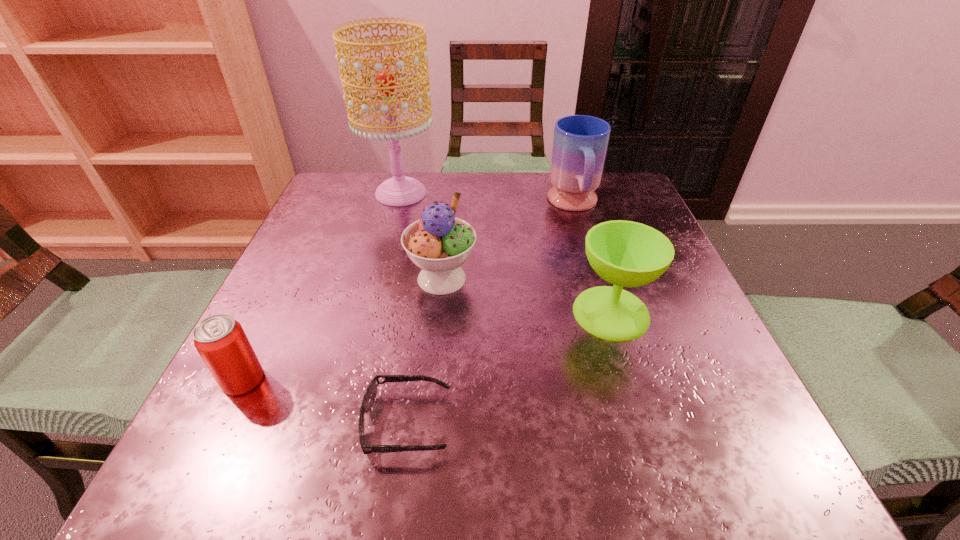
This screenshot has width=960, height=540. Find the location of `free space between the icecream and the can`. free space between the icecream and the can is located at coordinates (343, 329).

The image size is (960, 540). What are the coordinates of `vacant space that is in between the leftmost object and the mug` in the screenshot? It's located at (409, 292).

At what (x,y) coordinates should I click in order to perform the action: click on vacant point located between the wineglass and the second shortest object. Please return your answer as a coordinate pair (x, y). Looking at the image, I should click on (427, 346).

This screenshot has height=540, width=960. Identify the location of free space between the icecream and the can. (343, 329).

Where is `unoccupied area between the mug and the fifth tallest object`? Image resolution: width=960 pixels, height=540 pixels. unoccupied area between the mug and the fifth tallest object is located at coordinates (409, 292).

This screenshot has width=960, height=540. What are the coordinates of `vacant space that's between the wineglass and the tallest object` in the screenshot? It's located at (506, 253).

You are a GUI agent. You are given a task and a screenshot of the screen. Output one action in this format:
    pyautogui.click(x=<x>, y=<y>)
    Task: Click on the vacant area that lies between the can and the shortest object
    Image resolution: width=960 pixels, height=540 pixels.
    Given the screenshot: What is the action you would take?
    pyautogui.click(x=325, y=401)

The image size is (960, 540). I want to click on the fifth closest object to the wineglass, so click(x=220, y=340).

Locate which object ranks in proximity to the mug. Please provide its 2D coordinates. Your answer should be formatted as a tuple, i.e. [(x, y)], where the tuple contains the x and y coordinates of a point satisfying the conditions above.

[(624, 253)]

Locate an element on the screen. This screenshot has width=960, height=540. vacant space that satisfies the following two spatial constraints: 1. on the side of the mug with the handle; 2. on the right side of the wineglass is located at coordinates (607, 313).